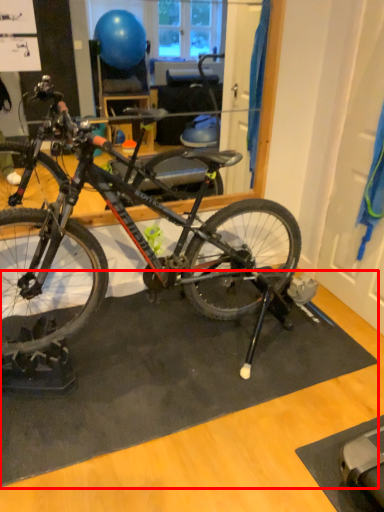
Question: Observing the image, what is the correct spatial positioning of doormat (annotated by the red box) in reference to bicycle?

Choices:
 (A) right
 (B) left

Answer: (A)